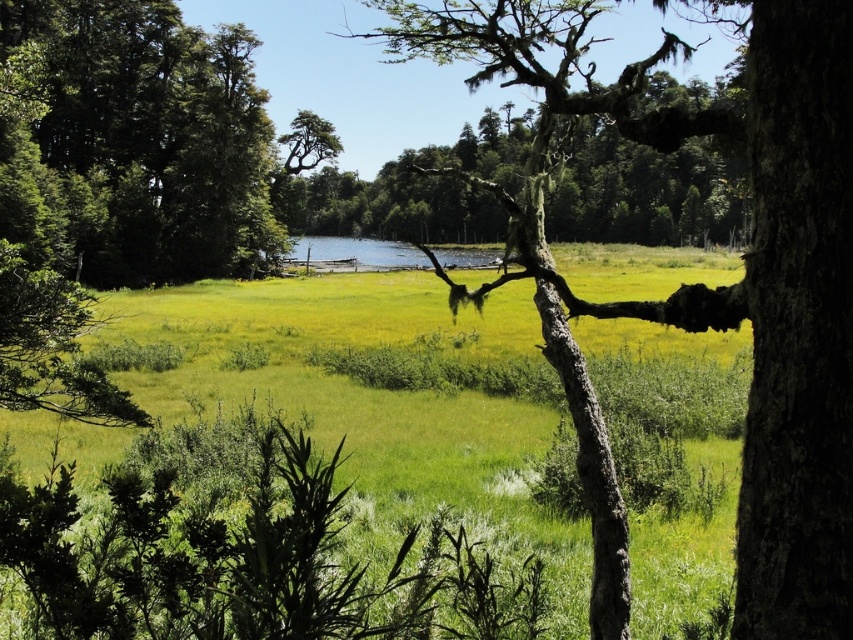
Is green leafy tree at left taller than clear blue water at center?

Yes, green leafy tree at left is taller than clear blue water at center.

Can you confirm if green leafy tree at left is bigger than clear blue water at center?

Indeed, green leafy tree at left has a larger size compared to clear blue water at center.

Find the location of a particular element. This screenshot has height=640, width=853. green leafy tree at left is located at coordinates (138, 144).

Does smooth bark tree at center have a lesser width compared to clear blue water at center?

In fact, smooth bark tree at center might be wider than clear blue water at center.

I want to click on smooth bark tree at center, so click(x=543, y=218).

Who is more forward, (88, 10) or (440, 52)?

Point (440, 52) is more forward.

Can you confirm if green leafy tree at left is positioned above smooth bark tree at center?

No.

Is point (181, 256) positioned before point (410, 4)?

No, (181, 256) is further to viewer.

Locate an element on the screen. This screenshot has width=853, height=640. green leafy tree at left is located at coordinates (138, 144).